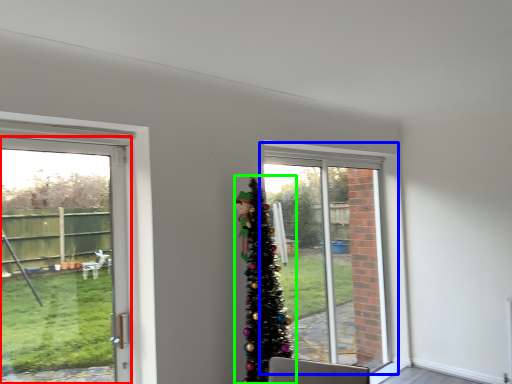
Question: Which object is the closest to the door (highlighted by a red box)? Choose among these: window (highlighted by a blue box) or christmas tree (highlighted by a green box).

Choices:
 (A) window
 (B) christmas tree

Answer: (B)